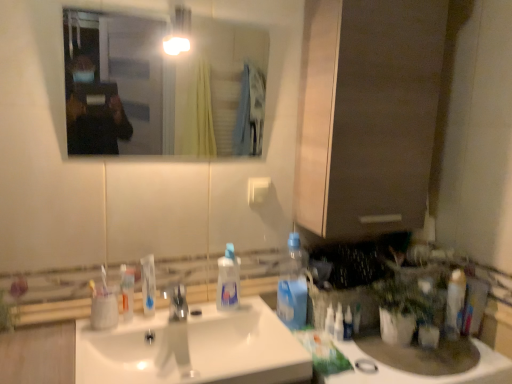
Question: Is clear plastic spray bottle at right, placed as the first cleaning product when sorted from right to left, thinner than white glossy toothpaste tube at right, placed as the first toiletry when sorted from right to left?

Choices:
 (A) no
 (B) yes

Answer: (B)

Question: Is clear plastic spray bottle at right, placed as the first cleaning product when sorted from right to left, not within white glossy toothpaste tube at right, placed as the first toiletry when sorted from right to left?

Choices:
 (A) no
 (B) yes

Answer: (B)

Question: Is clear plastic spray bottle at right, placed as the first cleaning product when sorted from right to left, wider than white glossy toothpaste tube at right, which ranks as the 2th toiletry in left-to-right order?

Choices:
 (A) no
 (B) yes

Answer: (A)

Question: From the image's perspective, is clear plastic spray bottle at right, which ranks as the third cleaning product in left-to-right order, below white glossy toothpaste tube at right, placed as the first toiletry when sorted from right to left?

Choices:
 (A) no
 (B) yes

Answer: (B)

Question: Is the depth of clear plastic spray bottle at right, placed as the first cleaning product when sorted from right to left, greater than that of white glossy toothpaste tube at right, placed as the first toiletry when sorted from right to left?

Choices:
 (A) no
 (B) yes

Answer: (B)

Question: Considering the relative sizes of clear plastic spray bottle at right, placed as the first cleaning product when sorted from right to left, and white glossy toothpaste tube at right, placed as the first toiletry when sorted from right to left, in the image provided, is clear plastic spray bottle at right, placed as the first cleaning product when sorted from right to left, smaller than white glossy toothpaste tube at right, placed as the first toiletry when sorted from right to left,?

Choices:
 (A) yes
 (B) no

Answer: (A)

Question: Is translucent plastic mouthwash at sink oriented away from white glossy sink at center?

Choices:
 (A) no
 (B) yes

Answer: (A)

Question: From the image's perspective, would you say translucent plastic mouthwash at sink is shown under white glossy sink at center?

Choices:
 (A) no
 (B) yes

Answer: (A)

Question: Is translucent plastic mouthwash at sink positioned far away from white glossy sink at center?

Choices:
 (A) yes
 (B) no

Answer: (B)

Question: Can you confirm if translucent plastic mouthwash at sink is positioned to the right of white glossy sink at center?

Choices:
 (A) no
 (B) yes

Answer: (A)

Question: Considering the relative sizes of translucent plastic mouthwash at sink and white glossy sink at center in the image provided, is translucent plastic mouthwash at sink thinner than white glossy sink at center?

Choices:
 (A) yes
 (B) no

Answer: (A)

Question: From a real-world perspective, is translucent plastic mouthwash at sink beneath white glossy sink at center?

Choices:
 (A) yes
 (B) no

Answer: (B)

Question: From a real-world perspective, is matte brown cabinet at center positioned over white glossy toothpaste tube at right, placed as the first toiletry when sorted from right to left, based on gravity?

Choices:
 (A) no
 (B) yes

Answer: (B)